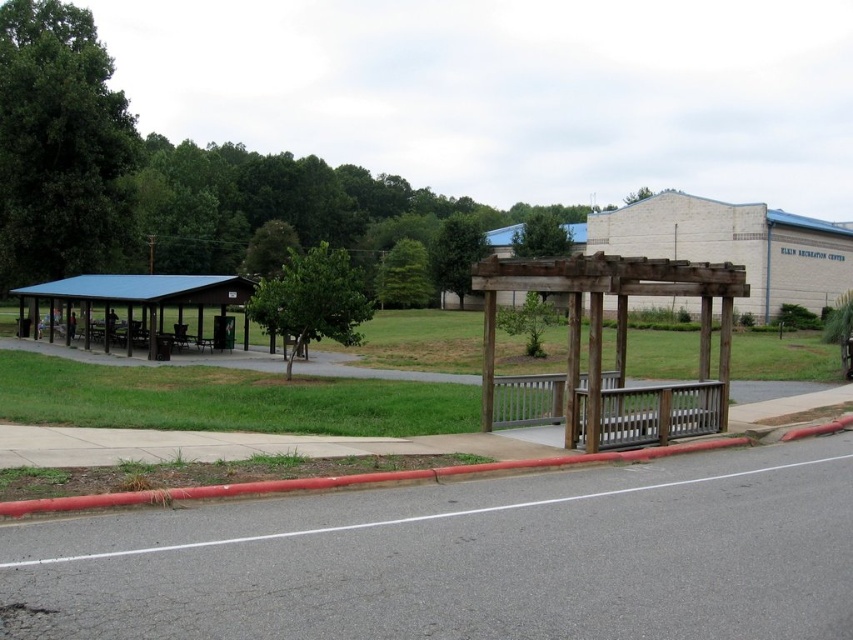
Can you confirm if brown wooden gazebo at center is smaller than red rubber curb at lower left?

No.

The width and height of the screenshot is (853, 640). I want to click on brown wooden gazebo at center, so click(x=614, y=349).

Where is `brown wooden gazebo at center`? The width and height of the screenshot is (853, 640). brown wooden gazebo at center is located at coordinates (614, 349).

Can you confirm if wooden pergola at upper right is thinner than red rubber curb at lower left?

In fact, wooden pergola at upper right might be wider than red rubber curb at lower left.

Can you confirm if wooden pergola at upper right is positioned to the right of red rubber curb at lower left?

Yes, wooden pergola at upper right is to the right of red rubber curb at lower left.

Locate an element on the screen. Image resolution: width=853 pixels, height=640 pixels. wooden pergola at upper right is located at coordinates (735, 244).

Can you confirm if brown wooden gazebo at center is positioned above wooden pergola at upper right?

Incorrect, brown wooden gazebo at center is not positioned above wooden pergola at upper right.

Which is below, brown wooden gazebo at center or wooden pergola at upper right?

brown wooden gazebo at center is lower down.

Between point (523, 417) and point (671, 211), which one is positioned behind?

The point (671, 211) is behind.

This screenshot has height=640, width=853. What are the coordinates of `brown wooden gazebo at center` in the screenshot? It's located at (614, 349).